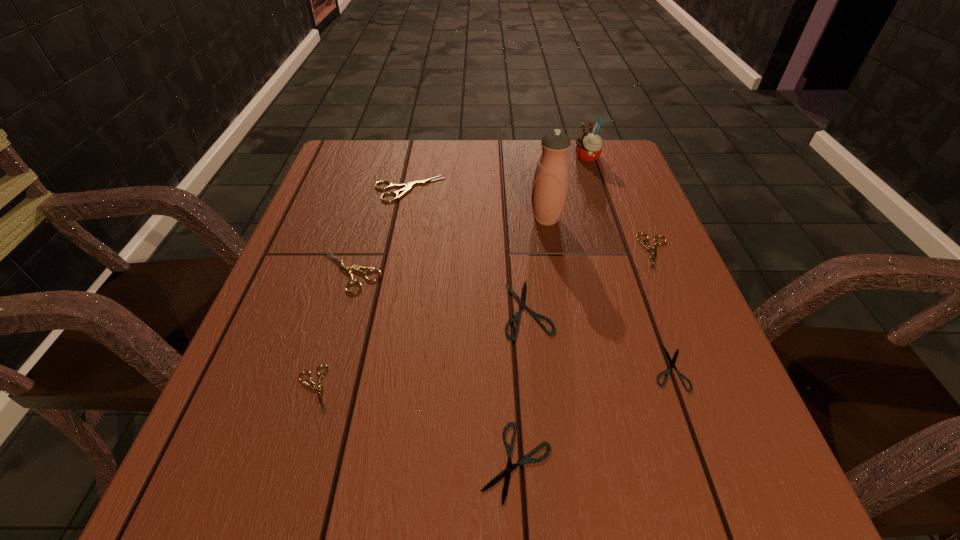
Find the location of a particular element. This screenshot has width=960, height=540. the farthest black shears is located at coordinates (521, 301).

Where is `the smallest beige shears`? the smallest beige shears is located at coordinates (319, 388).

This screenshot has width=960, height=540. Find the location of `the nearest shears`. the nearest shears is located at coordinates click(507, 472).

You are a GUI agent. You are given a task and a screenshot of the screen. Output one action in this format:
    pyautogui.click(x=<x>, y=<y>)
    Task: Click on the second smallest black shears
    The width and height of the screenshot is (960, 540).
    Given the screenshot: What is the action you would take?
    pyautogui.click(x=507, y=472)

At what (x,y) coordinates should I click in order to perform the action: click on the shortest shears. Please return your answer as a coordinate pair (x, y). Looking at the image, I should click on (672, 365).

The image size is (960, 540). Find the location of `the second nearest black shears`. the second nearest black shears is located at coordinates (672, 365).

Locate an element on the screen. Image resolution: width=960 pixels, height=540 pixels. free location located 0.190m on the front of the third farthest object is located at coordinates (559, 291).

In order to click on free space located on the front-facing side of the farthest object in this screenshot , I will do point(520,157).

This screenshot has height=540, width=960. Identify the location of vacant space located on the front-facing side of the farthest object. (485, 157).

You are a GUI agent. You are given a task and a screenshot of the screen. Output one action in this format:
    pyautogui.click(x=<x>, y=<y>)
    Task: Click on the vacant point located on the front-facing side of the farthest object
    The image size is (960, 540).
    Given the screenshot: What is the action you would take?
    pyautogui.click(x=456, y=157)